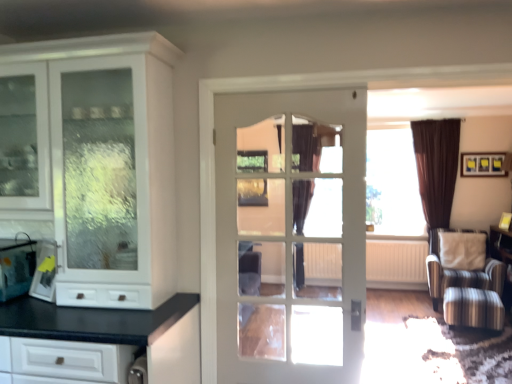
Question: Would you say black velvet curtain at center is a long distance from white textured radiator at center?

Choices:
 (A) no
 (B) yes

Answer: (B)

Question: Is white textured radiator at center inside black velvet curtain at center?

Choices:
 (A) yes
 (B) no

Answer: (B)

Question: Considering the relative sizes of black velvet curtain at center and white textured radiator at center in the image provided, is black velvet curtain at center smaller than white textured radiator at center?

Choices:
 (A) yes
 (B) no

Answer: (B)

Question: Can you confirm if black velvet curtain at center is taller than white textured radiator at center?

Choices:
 (A) yes
 (B) no

Answer: (A)

Question: Considering the relative sizes of black velvet curtain at center and white textured radiator at center in the image provided, is black velvet curtain at center thinner than white textured radiator at center?

Choices:
 (A) no
 (B) yes

Answer: (B)

Question: Considering the positions of white glass door at center and beige fabric pillow at right in the image, is white glass door at center bigger or smaller than beige fabric pillow at right?

Choices:
 (A) small
 (B) big

Answer: (B)

Question: Would you say white glass door at center is to the left or to the right of beige fabric pillow at right in the picture?

Choices:
 (A) right
 (B) left

Answer: (B)

Question: From a real-world perspective, is white glass door at center above or below beige fabric pillow at right?

Choices:
 (A) below
 (B) above

Answer: (B)

Question: In terms of height, does white glass door at center look taller or shorter compared to beige fabric pillow at right?

Choices:
 (A) short
 (B) tall

Answer: (B)

Question: Do you think beige fabric pillow at right is within white glass door at center, or outside of it?

Choices:
 (A) inside
 (B) outside

Answer: (B)

Question: In terms of size, does beige fabric pillow at right appear bigger or smaller than white glass door at center?

Choices:
 (A) big
 (B) small

Answer: (B)

Question: Is point (481, 251) closer or farther from the camera than point (278, 276)?

Choices:
 (A) farther
 (B) closer

Answer: (A)

Question: From a real-world perspective, is beige fabric pillow at right above or below white glass door at center?

Choices:
 (A) below
 (B) above

Answer: (A)

Question: In the image, is beige fabric pillow at right on the left side or the right side of white glossy cabinet at left?

Choices:
 (A) left
 (B) right

Answer: (B)

Question: Is beige fabric pillow at right inside the boundaries of white glossy cabinet at left, or outside?

Choices:
 (A) outside
 (B) inside

Answer: (A)